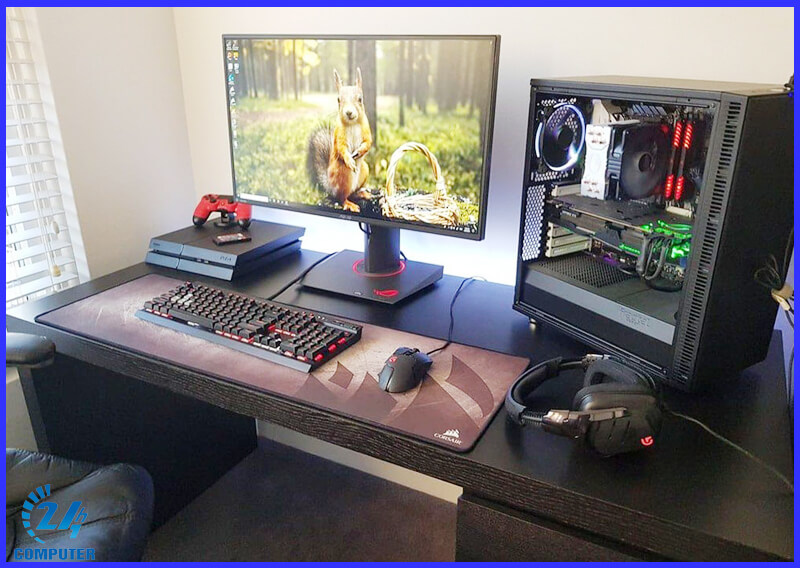
Find the location of a particular element. This screenshot has height=568, width=800. fans is located at coordinates (562, 140), (653, 183).